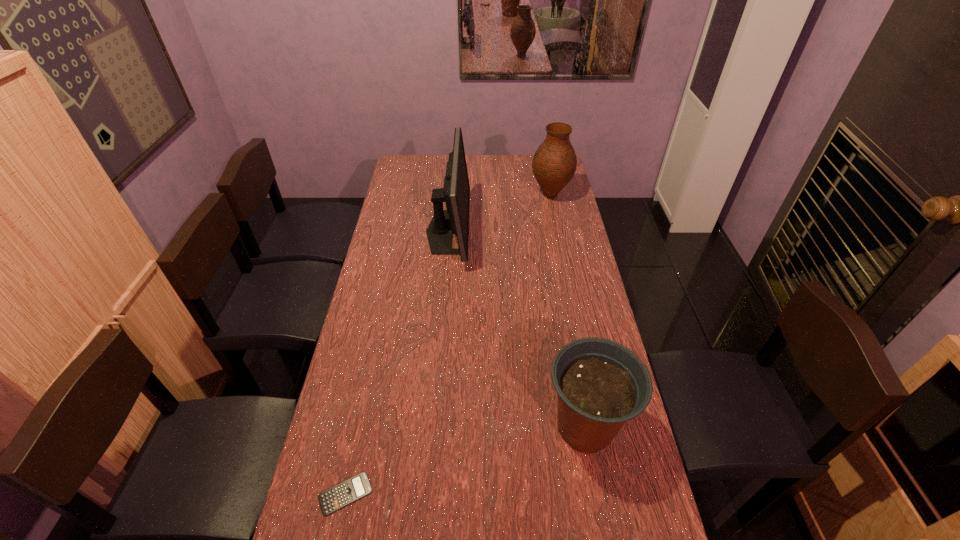
You are a GUI agent. You are given a task and a screenshot of the screen. Output one action in this format:
    pyautogui.click(x=<x>, y=<y>)
    Task: Click on the third object from right to left
    
    Given the screenshot: What is the action you would take?
    pyautogui.click(x=455, y=193)

Where is `vase`? vase is located at coordinates (554, 163).

The image size is (960, 540). I want to click on the third tallest object, so click(x=601, y=384).

You are a GUI agent. You are given a task and a screenshot of the screen. Output one action in this format:
    pyautogui.click(x=<x>, y=<y>)
    Task: Click on the third farthest object
    This screenshot has height=540, width=960.
    Given the screenshot: What is the action you would take?
    pyautogui.click(x=601, y=384)

Locate an element on the screen. This screenshot has height=540, width=960. the leftmost object is located at coordinates (354, 488).

Identify the location of the shortest object. Image resolution: width=960 pixels, height=540 pixels. (354, 488).

Identify the location of vacant region located 0.340m on the screen side of the computer monitor. This screenshot has width=960, height=540. (549, 232).

In order to click on vacant point located 0.330m on the left of the vase in this screenshot , I will do `click(460, 195)`.

Identify the location of vacant space located on the back of the flowerpot. (567, 329).

You are a GUI agent. You are given a task and a screenshot of the screen. Output one action in this format:
    pyautogui.click(x=<x>, y=<y>)
    Task: Click on the blank space located 0.240m on the right of the leftmost object
    The height and width of the screenshot is (540, 960).
    Given the screenshot: What is the action you would take?
    pyautogui.click(x=468, y=494)